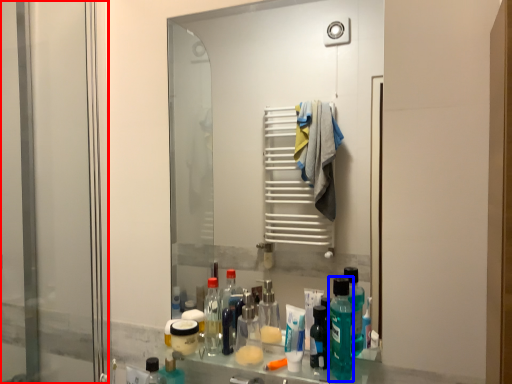
Question: Which object appears closest to the camera in this image, screen door (highlighted by a red box) or cleaning product (highlighted by a blue box)?

Choices:
 (A) screen door
 (B) cleaning product

Answer: (B)